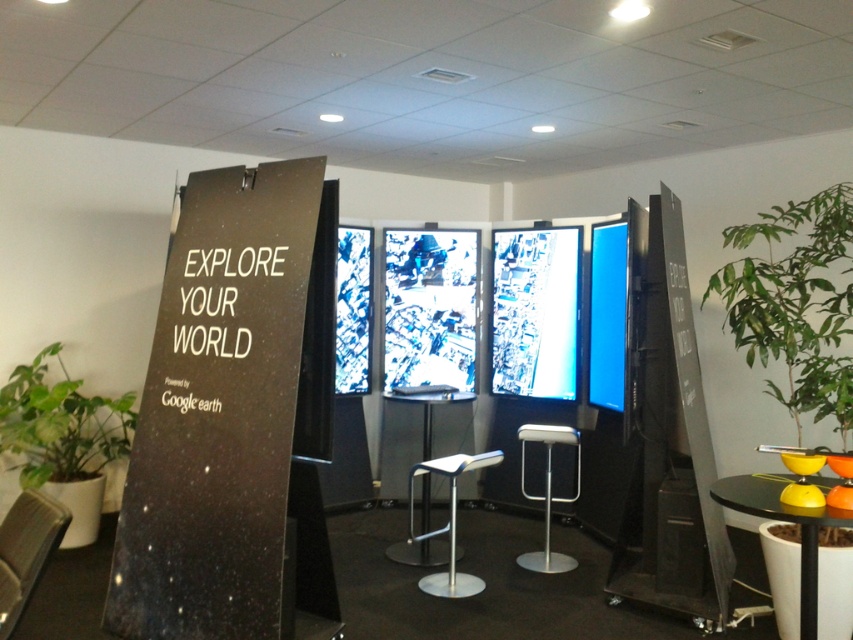
You are standing in the room and want to sit down on the white plastic bar stool at center. To reach it, you need to walk past the green leafy plant at lower left. Which object will you encounter first?

You will encounter the green leafy plant at lower left first because it is closer to the viewer than the white plastic bar stool at center.

You are a visitor at the Google Earth showcase and want to sit down to explore the displays. Which object, the green leafy plant at right or the silver metallic bar stool at center, is more suitable for sitting?

A: The silver metallic bar stool at center is more suitable for sitting since it is designed for seating, whereas the green leafy plant at right is a plant and cannot be sat on.

You are standing in the room and want to move from the green leafy plant at right to the silver metallic bar stool at center. Which direction should you move to get closer to the stool?

Since the green leafy plant at right is closer to the viewer than the silver metallic bar stool at center, you should move forward towards the center of the room to reach the stool.